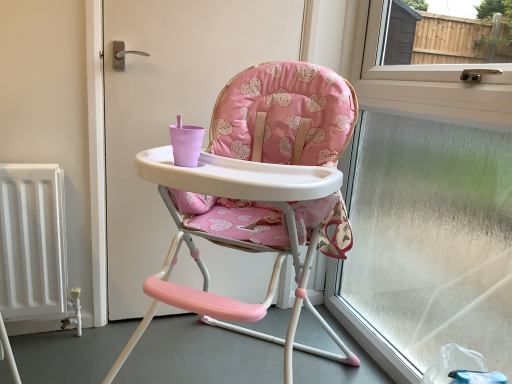
Question: Do you think pink fabric highchair at center is within transparent glass window at right, or outside of it?

Choices:
 (A) inside
 (B) outside

Answer: (B)

Question: From the image's perspective, relative to transparent glass window at right, is pink fabric highchair at center above or below?

Choices:
 (A) below
 (B) above

Answer: (A)

Question: Is pink fabric highchair at center taller or shorter than transparent glass window at right?

Choices:
 (A) short
 (B) tall

Answer: (A)

Question: Is transparent glass window at right inside the boundaries of pink fabric highchair at center, or outside?

Choices:
 (A) outside
 (B) inside

Answer: (A)

Question: Considering the positions of transparent glass window at right and pink fabric highchair at center in the image, is transparent glass window at right wider or thinner than pink fabric highchair at center?

Choices:
 (A) wide
 (B) thin

Answer: (B)

Question: Considering their positions, is transparent glass window at right located in front of or behind pink fabric highchair at center?

Choices:
 (A) behind
 (B) front

Answer: (A)

Question: Would you say transparent glass window at right is to the left or to the right of pink fabric highchair at center in the picture?

Choices:
 (A) left
 (B) right

Answer: (B)